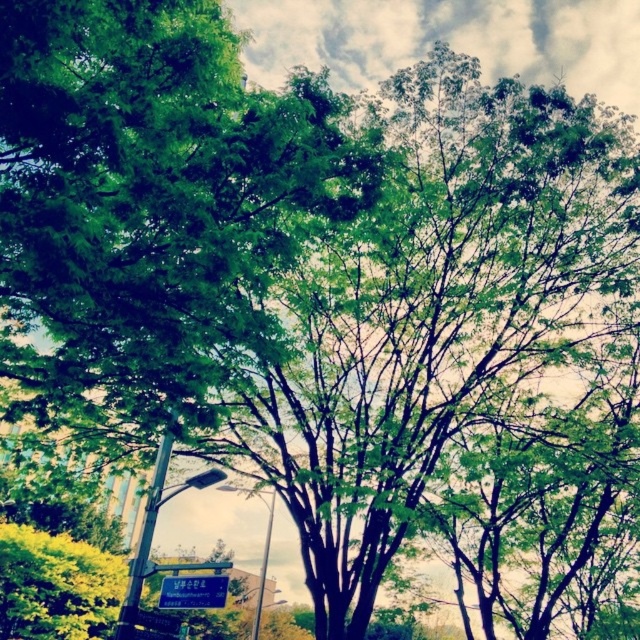
Question: Which object is farther from the camera taking this photo?

Choices:
 (A) metallic pole at left
 (B) metallic pole at center
 (C) green plastic street sign at lower center

Answer: (B)

Question: Can you confirm if metallic pole at left is positioned to the left of metallic pole at center?

Choices:
 (A) no
 (B) yes

Answer: (A)

Question: Which point appears closest to the camera in this image?

Choices:
 (A) (132, 636)
 (B) (212, 588)
 (C) (257, 636)

Answer: (A)

Question: Is metallic pole at left thinner than green plastic street sign at lower center?

Choices:
 (A) yes
 (B) no

Answer: (A)

Question: Does metallic pole at left have a larger size compared to metallic pole at center?

Choices:
 (A) no
 (B) yes

Answer: (A)

Question: Among these points, which one is farthest from the camera?

Choices:
 (A) (257, 488)
 (B) (202, 602)

Answer: (A)